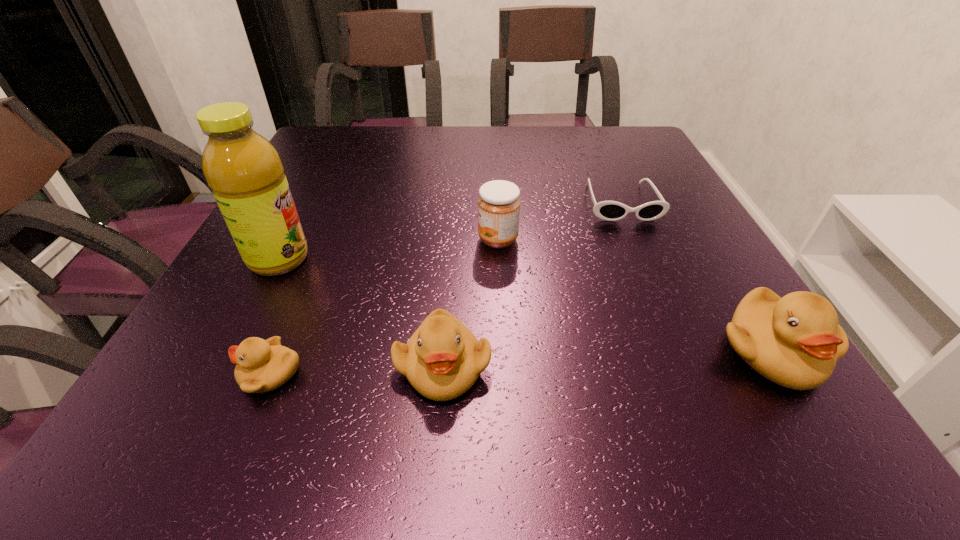
You are a GUI agent. You are given a task and a screenshot of the screen. Output one action in this format:
    pyautogui.click(x=<x>, y=<y>)
    Task: Click on the free location located 0.110m at the beak of the shortest duckling
    This screenshot has height=540, width=960.
    Given the screenshot: What is the action you would take?
    pyautogui.click(x=168, y=374)

Locate an element on the screen. The image size is (960, 540). free space located with the lenses of the shortest object facing outward is located at coordinates (657, 285).

I want to click on vacant space located 0.170m on the front label of the jam, so click(396, 240).

Where is `vacant region located on the front label of the jam`? The image size is (960, 540). vacant region located on the front label of the jam is located at coordinates (349, 240).

Identify the location of vacant position located 0.280m on the front label of the jam. The width and height of the screenshot is (960, 540). (345, 240).

The width and height of the screenshot is (960, 540). Identify the location of vacant point located 0.260m on the front label of the tallest object. (441, 259).

The height and width of the screenshot is (540, 960). Identify the location of duckling present at the left edge. (262, 365).

Where is `fruit juice that is positioned at the left edge`? This screenshot has width=960, height=540. fruit juice that is positioned at the left edge is located at coordinates (246, 175).

Identify the location of duckling that is at the right edge. (795, 341).

Identify the location of sunglasses present at the right edge. The width and height of the screenshot is (960, 540). click(x=606, y=210).